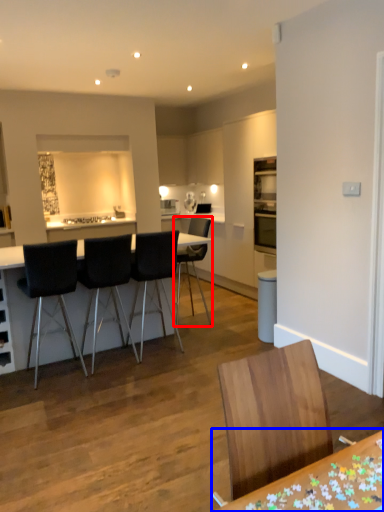
Question: Which object is further to the camera taking this photo, chair (highlighted by a red box) or table (highlighted by a blue box)?

Choices:
 (A) chair
 (B) table

Answer: (A)